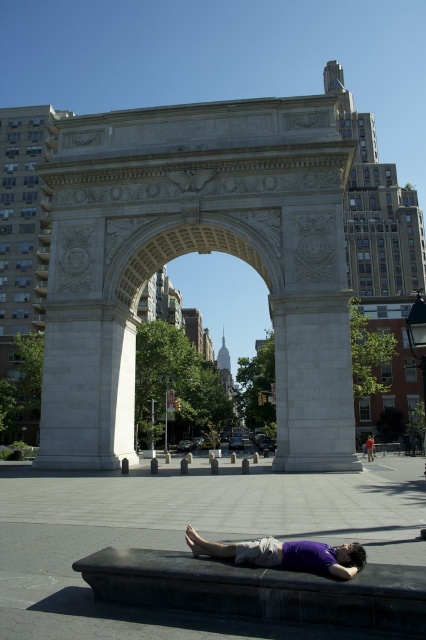
Question: Does purple matte shirt at lower center have a larger size compared to purple fabric at lower center?

Choices:
 (A) yes
 (B) no

Answer: (B)

Question: Does purple matte shirt at lower center have a greater width compared to purple fabric at lower center?

Choices:
 (A) yes
 (B) no

Answer: (B)

Question: Does purple matte shirt at lower center appear over purple fabric at lower center?

Choices:
 (A) no
 (B) yes

Answer: (B)

Question: Which of the following is the farthest from the observer?

Choices:
 (A) (256, 554)
 (B) (371, 442)

Answer: (B)

Question: Which object is farther from the camera taking this photo?

Choices:
 (A) purple fabric at lower center
 (B) purple matte shirt at lower center

Answer: (A)